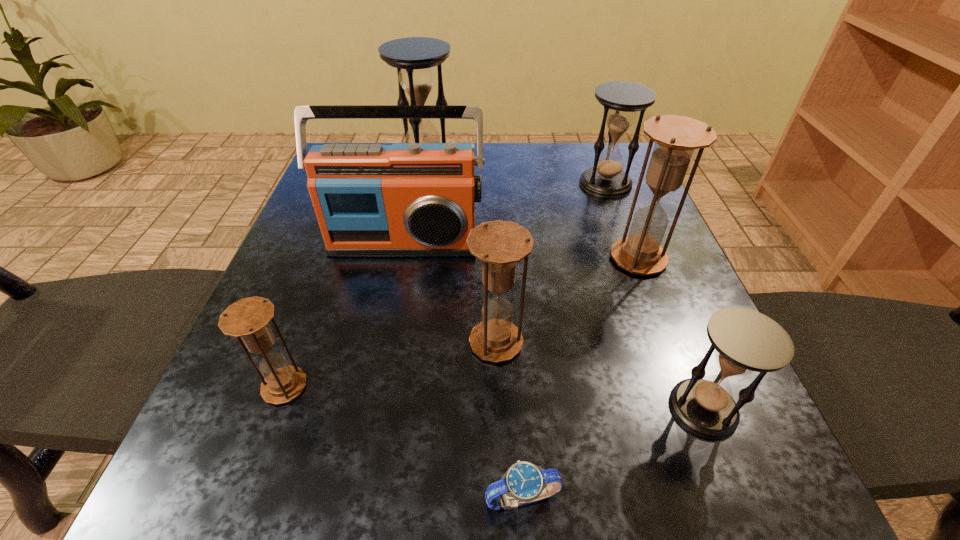
Identify the location of vacant space located on the left of the blue watch. The width and height of the screenshot is (960, 540). tap(248, 498).

Where is `object present at the near edge`? The image size is (960, 540). object present at the near edge is located at coordinates (522, 484).

In order to click on radio receiver that is at the left edge in this screenshot , I will do [x=406, y=199].

Image resolution: width=960 pixels, height=540 pixels. I want to click on object that is at the far left corner, so click(414, 57).

Where is `object at the far right corner`? The image size is (960, 540). object at the far right corner is located at coordinates click(606, 179).

In the image, there is a desktop. Where is `free space at the far edge`? free space at the far edge is located at coordinates (514, 167).

The width and height of the screenshot is (960, 540). Identify the location of vacant space at the left edge. (239, 408).

At what (x,y) coordinates should I click in order to perform the action: click on free region at the right edge of the desktop. Please return your answer as a coordinate pair (x, y). The height and width of the screenshot is (540, 960). Looking at the image, I should click on (676, 308).

Where is `free space at the near left corner of the desktop`? free space at the near left corner of the desktop is located at coordinates (217, 471).

The width and height of the screenshot is (960, 540). In the image, there is a desktop. Identify the location of vacant space at the far right corner. (625, 165).